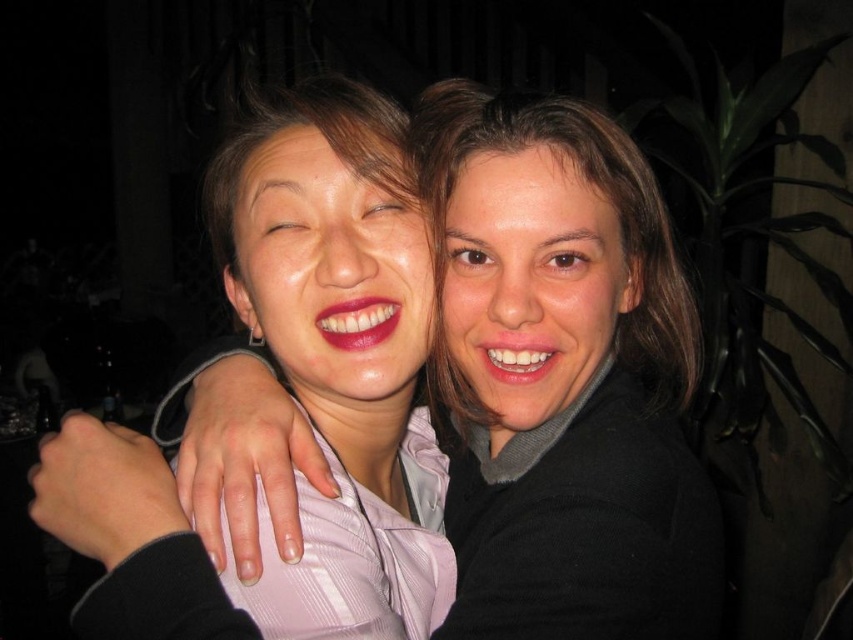
Question: Which point is farther from the camera taking this photo?

Choices:
 (A) (624, 244)
 (B) (258, 184)

Answer: (B)

Question: Is matte pink shirt at center thinner than smooth brown hair at center?

Choices:
 (A) yes
 (B) no

Answer: (A)

Question: In this image, where is matte pink shirt at center located relative to smooth brown hair at center?

Choices:
 (A) right
 (B) left

Answer: (B)

Question: Can you confirm if matte pink shirt at center is bigger than smooth brown hair at center?

Choices:
 (A) yes
 (B) no

Answer: (B)